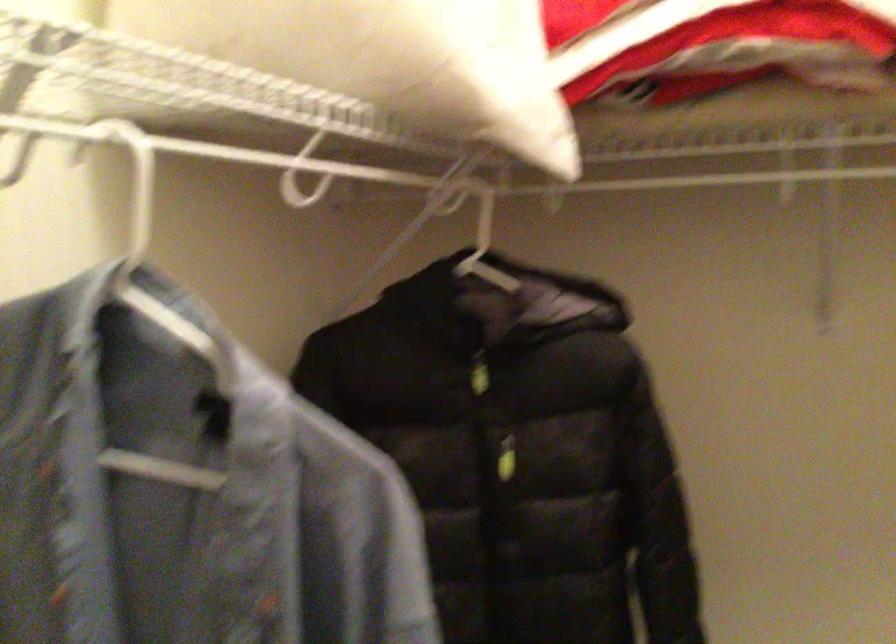
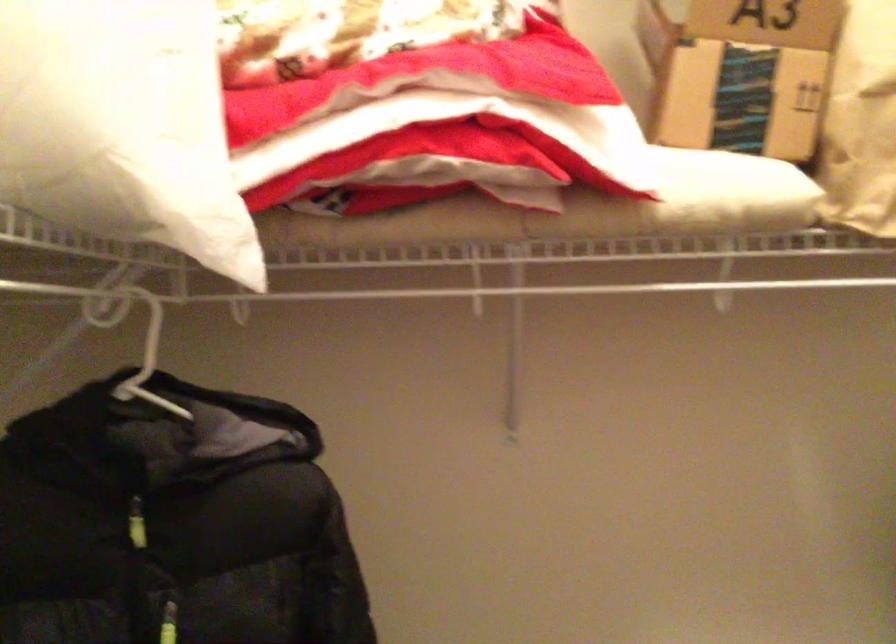
The point at [501,458] is marked in the first image. Where is the corresponding point in the second image?

(168, 623)